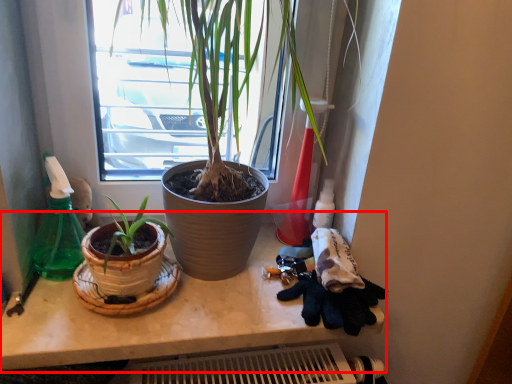
Question: Considering the relative positions of counter (annotated by the red box) and bottle in the image provided, where is counter (annotated by the red box) located with respect to the staircase?

Choices:
 (A) right
 (B) left

Answer: (A)